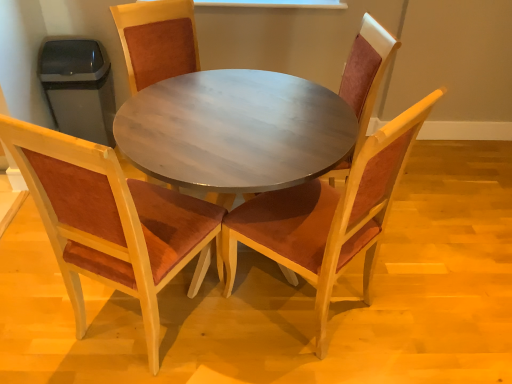
This screenshot has width=512, height=384. What do you see at coordinates (157, 40) in the screenshot?
I see `wooden chair with brown cushion at center, acting as the third chair starting from the right` at bounding box center [157, 40].

What do you see at coordinates (111, 221) in the screenshot? This screenshot has height=384, width=512. I see `matte wood table at center` at bounding box center [111, 221].

What do you see at coordinates (328, 216) in the screenshot? The height and width of the screenshot is (384, 512). I see `velvet red chair at center, the third chair when ordered from left to right` at bounding box center [328, 216].

This screenshot has width=512, height=384. In order to click on velvet brown chair at left, arranged as the first chair when viewed from the left in this screenshot , I will do `click(111, 221)`.

Measure the distance between velvet brown chair at left, which ranks as the fourth chair in right-to-left order, and camera.

They are 37.88 inches apart.

Where is `wooden table at center`? The image size is (512, 384). wooden table at center is located at coordinates (234, 130).

Is velvet brown chair at left, which ranks as the fourth chair in right-to-left order, shorter than velvet red chair at center, which is counted as the second chair, starting from the right?

Yes.

Considering the relative sizes of velvet brown chair at left, which ranks as the fourth chair in right-to-left order, and velvet red chair at center, which is counted as the second chair, starting from the right, in the image provided, is velvet brown chair at left, which ranks as the fourth chair in right-to-left order, wider than velvet red chair at center, which is counted as the second chair, starting from the right,?

Correct, the width of velvet brown chair at left, which ranks as the fourth chair in right-to-left order, exceeds that of velvet red chair at center, which is counted as the second chair, starting from the right.

Is velvet brown chair at left, which ranks as the fourth chair in right-to-left order, inside the boundaries of velvet red chair at center, the third chair when ordered from left to right, or outside?

velvet brown chair at left, which ranks as the fourth chair in right-to-left order, is not enclosed by velvet red chair at center, the third chair when ordered from left to right.

Would you say velvet brown chair at left, which ranks as the fourth chair in right-to-left order, is to the left or to the right of velvet red chair at center, which is counted as the second chair, starting from the right, in the picture?

velvet brown chair at left, which ranks as the fourth chair in right-to-left order, is to the left of velvet red chair at center, which is counted as the second chair, starting from the right.

Considering the sizes of objects velvet brown chair at left, which ranks as the fourth chair in right-to-left order, and matte wood table at center in the image provided, who is shorter, velvet brown chair at left, which ranks as the fourth chair in right-to-left order, or matte wood table at center?

With less height is matte wood table at center.

Consider the image. How different are the orientations of velvet brown chair at left, which ranks as the fourth chair in right-to-left order, and matte wood table at center in degrees?

They differ by 25.8 degrees in their facing directions.

Is velvet brown chair at left, arranged as the first chair when viewed from the left, to the left or to the right of matte wood table at center in the image?

velvet brown chair at left, arranged as the first chair when viewed from the left, is positioned on matte wood table at center's left side.

Is velvet brown chair at left, which ranks as the fourth chair in right-to-left order, facing away from matte wood table at center?

No.

Looking at this image, which object is thinner, velvet burgundy chair at center, which is the first chair in right-to-left order, or velvet brown chair at left, arranged as the first chair when viewed from the left?

velvet burgundy chair at center, which is the first chair in right-to-left order.

Who is bigger, velvet burgundy chair at center, which is the first chair in right-to-left order, or velvet brown chair at left, arranged as the first chair when viewed from the left?

Bigger between the two is velvet brown chair at left, arranged as the first chair when viewed from the left.

From the image's perspective, is velvet burgundy chair at center, which appears as the fourth chair when viewed from the left, above or below velvet brown chair at left, arranged as the first chair when viewed from the left?

Clearly, from the image's perspective, velvet burgundy chair at center, which appears as the fourth chair when viewed from the left, is above velvet brown chair at left, arranged as the first chair when viewed from the left.

In the scene shown: Is velvet burgundy chair at center, which is the first chair in right-to-left order, positioned far away from velvet brown chair at left, which ranks as the fourth chair in right-to-left order?

No, velvet burgundy chair at center, which is the first chair in right-to-left order, is in close proximity to velvet brown chair at left, which ranks as the fourth chair in right-to-left order.

Is velvet burgundy chair at center, which is the first chair in right-to-left order, to the right of matte wood table at center from the viewer's perspective?

Correct, you'll find velvet burgundy chair at center, which is the first chair in right-to-left order, to the right of matte wood table at center.

Is velvet burgundy chair at center, which is the first chair in right-to-left order, completely or partially outside of matte wood table at center?

velvet burgundy chair at center, which is the first chair in right-to-left order, is positioned outside matte wood table at center.

From the image's perspective, which one is positioned higher, velvet burgundy chair at center, which appears as the fourth chair when viewed from the left, or matte wood table at center?

velvet burgundy chair at center, which appears as the fourth chair when viewed from the left, from the image's perspective.

Is matte wood table at center positioned with its back to velvet brown chair at left, arranged as the first chair when viewed from the left?

matte wood table at center is not turned away from velvet brown chair at left, arranged as the first chair when viewed from the left.

From a real-world perspective, who is located lower, matte wood table at center or velvet brown chair at left, which ranks as the fourth chair in right-to-left order?

In real-world perspective, matte wood table at center is lower.

Is point (196, 114) less distant than point (53, 143)?

That is False.

Between wooden chair with brown cushion at center, acting as the third chair starting from the right, and matte wood table at center, which one is positioned in front?

Positioned in front is matte wood table at center.

Considering the relative positions of wooden chair with brown cushion at center, the 2th chair in the left-to-right sequence, and matte wood table at center in the image provided, is wooden chair with brown cushion at center, the 2th chair in the left-to-right sequence, to the left of matte wood table at center from the viewer's perspective?

Yes, wooden chair with brown cushion at center, the 2th chair in the left-to-right sequence, is to the left of matte wood table at center.

Locate an element on the screen. the 4th chair located above the matte wood table at center (from a real-world perspective) is located at coordinates (157, 40).

From the picture: Could matte wood table at center be considered to be inside wooden chair with brown cushion at center, the 2th chair in the left-to-right sequence?

Definitely not — matte wood table at center is not inside wooden chair with brown cushion at center, the 2th chair in the left-to-right sequence.

Based on the photo, from a real-world perspective, is matte wood table at center positioned above or below velvet red chair at center, which is counted as the second chair, starting from the right?

matte wood table at center is below velvet red chair at center, which is counted as the second chair, starting from the right.

Would you say matte wood table at center contains velvet red chair at center, the third chair when ordered from left to right?

No, velvet red chair at center, the third chair when ordered from left to right, is located outside of matte wood table at center.

Is the depth of matte wood table at center less than that of velvet red chair at center, which is counted as the second chair, starting from the right?

No, matte wood table at center is behind velvet red chair at center, which is counted as the second chair, starting from the right.

Could you measure the distance between matte wood table at center and velvet red chair at center, which is counted as the second chair, starting from the right?

matte wood table at center and velvet red chair at center, which is counted as the second chair, starting from the right, are 13.29 inches apart from each other.

Identify the location of the 1st chair above the velvet brown chair at left, which ranks as the fourth chair in right-to-left order (from the image's perspective). tap(328, 216).

Identify the location of the 2nd chair counting from the left of the matte wood table at center. This screenshot has height=384, width=512. (111, 221).

Which object lies nearer to the anchor point velvet red chair at center, which is counted as the second chair, starting from the right, matte wood table at center or velvet brown chair at left, arranged as the first chair when viewed from the left?

matte wood table at center.

Based on their spatial positions, is velvet red chair at center, which is counted as the second chair, starting from the right, or wooden chair with brown cushion at center, the 2th chair in the left-to-right sequence, further from velvet burgundy chair at center, which is the first chair in right-to-left order?

wooden chair with brown cushion at center, the 2th chair in the left-to-right sequence, is further to velvet burgundy chair at center, which is the first chair in right-to-left order.

When comparing their distances from velvet burgundy chair at center, which appears as the fourth chair when viewed from the left, does wooden chair with brown cushion at center, the 2th chair in the left-to-right sequence, or velvet red chair at center, which is counted as the second chair, starting from the right, seem closer?

velvet red chair at center, which is counted as the second chair, starting from the right, lies closer to velvet burgundy chair at center, which appears as the fourth chair when viewed from the left, than the other object.

Which object lies further to the anchor point velvet red chair at center, which is counted as the second chair, starting from the right, velvet burgundy chair at center, which appears as the fourth chair when viewed from the left, or velvet brown chair at left, arranged as the first chair when viewed from the left?

velvet brown chair at left, arranged as the first chair when viewed from the left, is further to velvet red chair at center, which is counted as the second chair, starting from the right.

Which object lies further to the anchor point wooden table at center, velvet burgundy chair at center, which is the first chair in right-to-left order, or matte wood table at center?

velvet burgundy chair at center, which is the first chair in right-to-left order.

Looking at the image, which one is located closer to wooden chair with brown cushion at center, the 2th chair in the left-to-right sequence, matte wood table at center or velvet burgundy chair at center, which is the first chair in right-to-left order?

The object closer to wooden chair with brown cushion at center, the 2th chair in the left-to-right sequence, is matte wood table at center.

Considering their positions, is wooden table at center positioned closer to velvet red chair at center, which is counted as the second chair, starting from the right, than velvet burgundy chair at center, which appears as the fourth chair when viewed from the left?

The object closer to velvet red chair at center, which is counted as the second chair, starting from the right, is velvet burgundy chair at center, which appears as the fourth chair when viewed from the left.

Looking at the image, which one is located further to velvet burgundy chair at center, which appears as the fourth chair when viewed from the left, velvet red chair at center, which is counted as the second chair, starting from the right, or matte wood table at center?

matte wood table at center.

You are a GUI agent. You are given a task and a screenshot of the screen. Output one action in this format:
    pyautogui.click(x=<x>, y=<y>)
    Task: Click on the coffee table that lies between wooden chair with brown cushion at center, acting as the third chair starting from the right, and velvet red chair at center, which is counted as the second chair, starting from the right, from top to bottom
    This screenshot has width=512, height=384.
    Given the screenshot: What is the action you would take?
    pyautogui.click(x=234, y=130)

Locate an element on the screen. The width and height of the screenshot is (512, 384). kitchen & dining room table between velvet brown chair at left, arranged as the first chair when viewed from the left, and velvet red chair at center, which is counted as the second chair, starting from the right, from left to right is located at coordinates (111, 221).

At what (x,y) coordinates should I click in order to perform the action: click on kitchen & dining room table between velvet red chair at center, which is counted as the second chair, starting from the right, and velvet burgundy chair at center, which appears as the fourth chair when viewed from the left, from front to back. Please return your answer as a coordinate pair (x, y). The height and width of the screenshot is (384, 512). Looking at the image, I should click on [111, 221].

You are a GUI agent. You are given a task and a screenshot of the screen. Output one action in this format:
    pyautogui.click(x=<x>, y=<y>)
    Task: Click on the coffee table between wooden chair with brown cushion at center, the 2th chair in the left-to-right sequence, and velvet brown chair at left, which ranks as the fourth chair in right-to-left order, in the vertical direction
    The width and height of the screenshot is (512, 384).
    Given the screenshot: What is the action you would take?
    pyautogui.click(x=234, y=130)